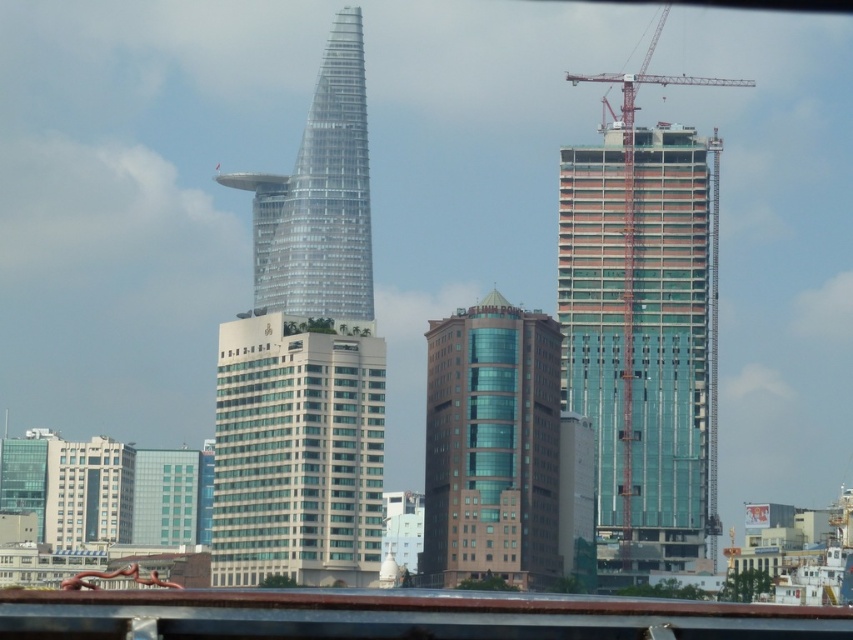
Question: Which of the following is the closest to the observer?

Choices:
 (A) (625, 202)
 (B) (514, 492)
 (C) (260, 404)

Answer: (C)

Question: Which of the following is the farthest from the observer?

Choices:
 (A) brown glass building at center
 (B) metallic construction crane at right
 (C) transparent glass skyscraper at center
 (D) white glass building at center

Answer: (B)

Question: Is the position of white glass building at center more distant than that of metallic construction crane at right?

Choices:
 (A) yes
 (B) no

Answer: (B)

Question: Can you confirm if brown glass building at center is positioned to the right of transparent glass skyscraper at center?

Choices:
 (A) no
 (B) yes

Answer: (B)

Question: Considering the real-world distances, which object is closest to the transparent glass skyscraper at center?

Choices:
 (A) white glass building at center
 (B) brown glass building at center

Answer: (B)

Question: Can you confirm if white glass building at center is bigger than transparent glass skyscraper at center?

Choices:
 (A) yes
 (B) no

Answer: (B)